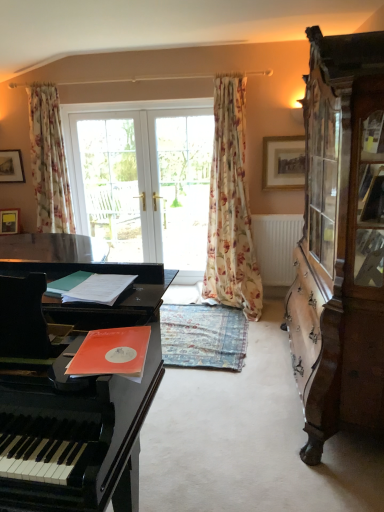
Question: Considering the positions of white glass doors at center and black polished piano at left in the image, is white glass doors at center taller or shorter than black polished piano at left?

Choices:
 (A) short
 (B) tall

Answer: (B)

Question: Choose the correct answer: Is white glass doors at center inside black polished piano at left or outside it?

Choices:
 (A) outside
 (B) inside

Answer: (A)

Question: Which object is the farthest from the wooden cabinet at right?

Choices:
 (A) black polished piano at left
 (B) wooden framed picture at upper right
 (C) white glossy door at center, which is the first screen door from right to left
 (D) floral fabric curtain at center, the first curtain from the right
 (E) clear glass door at center, which appears as the second screen door when viewed from the right

Answer: (C)

Question: Which object is positioned farthest from the floral fabric curtain at center, the first curtain from the right?

Choices:
 (A) wooden framed picture at upper right
 (B) black polished piano at left
 (C) white glass doors at center
 (D) wooden cabinet at right
 (E) white glossy door at center, which ranks as the 2th screen door in left-to-right order

Answer: (B)